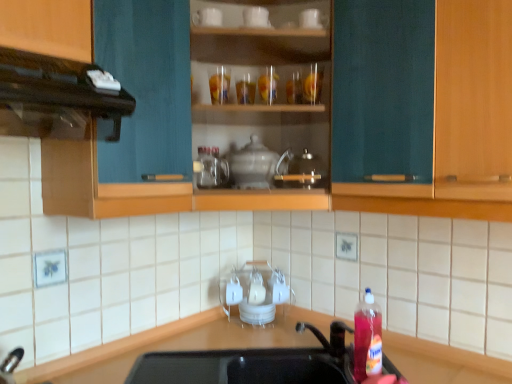
Question: Considering the positions of point (202, 9) and point (481, 18), is point (202, 9) closer or farther from the camera than point (481, 18)?

Choices:
 (A) closer
 (B) farther

Answer: (B)

Question: From a real-world perspective, is white ceramic mug at upper center, which is the second appliance from bottom to top, physically located above or below teal wood cabinet at center?

Choices:
 (A) above
 (B) below

Answer: (A)

Question: Which is farther from the teal wood cabinet at center?

Choices:
 (A) white glossy teapot at center, the second appliance viewed from the top
 (B) black matte vent at upper left
 (C) black matte sink at lower center
 (D) matte glass cabinet at upper center
 (E) translucent plastic bottle at lower right

Answer: (B)

Question: Based on their relative distances, which object is farther from the translucent plastic bottle at lower right?

Choices:
 (A) black matte sink at lower center
 (B) white glossy teapot at center, which appears as the first appliance when ordered from the bottom
 (C) black matte countertop at lower center
 (D) matte glass cabinet at upper center
 (E) white ceramic mug at upper center, which is the second appliance from bottom to top

Answer: (E)